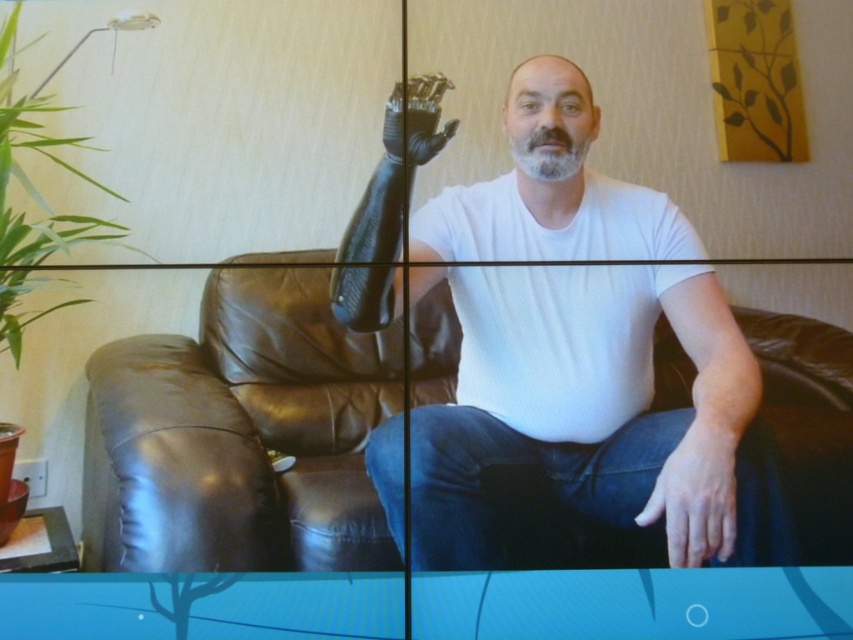
Question: Does matte black arm at upper left have a larger size compared to gray matte beard at center?

Choices:
 (A) no
 (B) yes

Answer: (B)

Question: Which object is the farthest from the matte black arm at upper left?

Choices:
 (A) black matte prosthetic hand at upper center
 (B) brown leather couch at center
 (C) smooth skin hand at lower right

Answer: (A)

Question: Which point appears farthest from the camera in this image?

Choices:
 (A) (456, 506)
 (B) (727, 490)
 (C) (223, 344)
 (D) (552, 156)

Answer: (C)

Question: Is the position of black matte prosthetic hand at upper center less distant than that of gray matte beard at center?

Choices:
 (A) yes
 (B) no

Answer: (A)

Question: Which point appears closest to the camera in this image?

Choices:
 (A) (413, 120)
 (B) (666, 509)
 (C) (804, 353)

Answer: (B)

Question: Does smooth skin hand at lower right have a smaller size compared to gray matte beard at center?

Choices:
 (A) yes
 (B) no

Answer: (B)